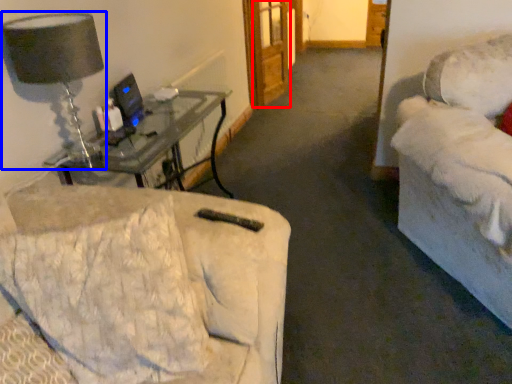
Question: Which object appears farthest to the camera in this image, glass door (highlighted by a red box) or table lamp (highlighted by a blue box)?

Choices:
 (A) glass door
 (B) table lamp

Answer: (A)